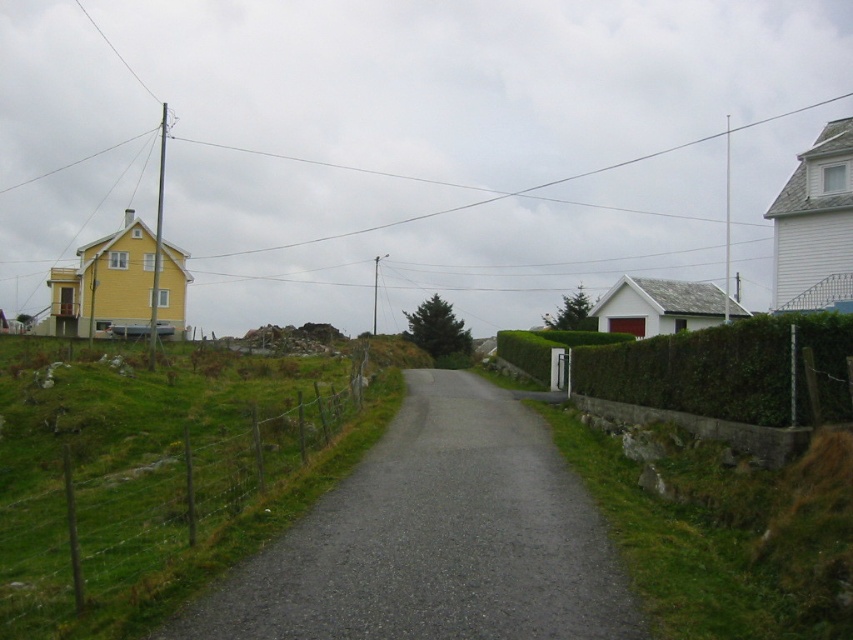
Question: Among these objects, which one is nearest to the camera?

Choices:
 (A) green wire fence at center
 (B) gray asphalt driveway at center
 (C) green hedge at right

Answer: (B)

Question: Among these objects, which one is nearest to the camera?

Choices:
 (A) green wire fence at center
 (B) gray asphalt driveway at center
 (C) green hedge at right

Answer: (B)

Question: Does green wire fence at center appear over green hedge at right?

Choices:
 (A) yes
 (B) no

Answer: (B)

Question: Considering the relative positions of green wire fence at center and green hedge at right in the image provided, where is green wire fence at center located with respect to green hedge at right?

Choices:
 (A) above
 (B) below

Answer: (B)

Question: Which object appears farthest from the camera in this image?

Choices:
 (A) green wire fence at center
 (B) gray asphalt driveway at center
 (C) green hedge at right

Answer: (C)

Question: Can you confirm if gray asphalt driveway at center is positioned below green hedge at right?

Choices:
 (A) no
 (B) yes

Answer: (B)